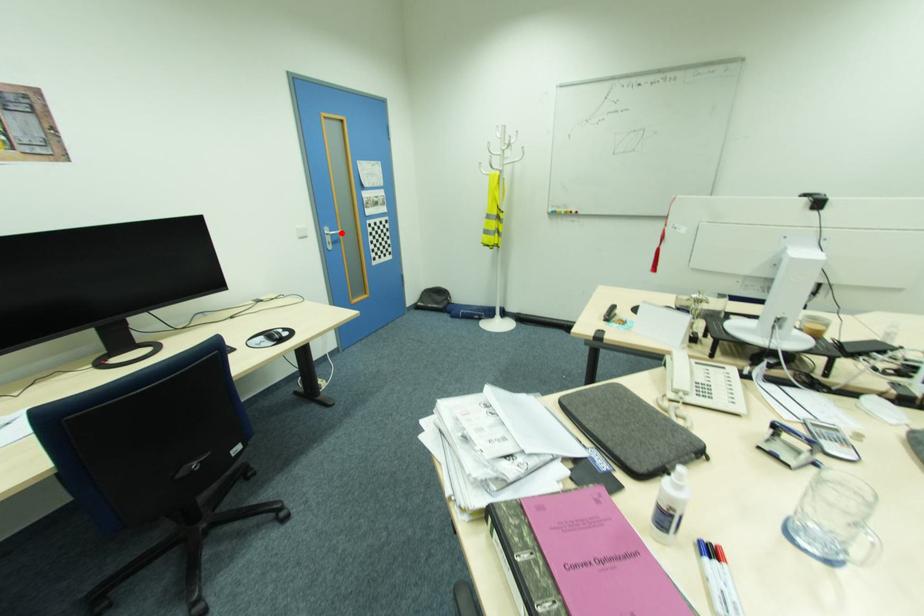
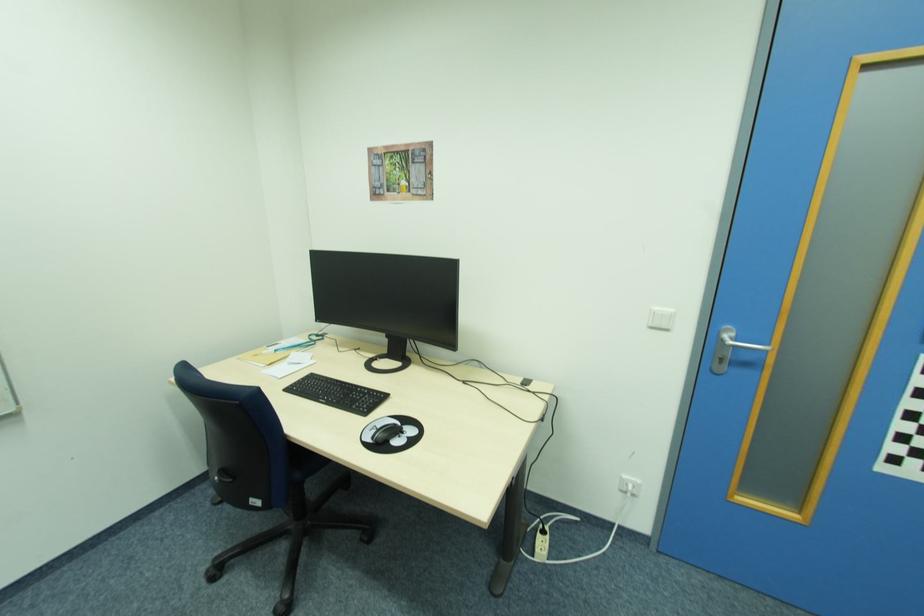
Question: A red point is marked in image1. In image2, is the corresponding 3D point closer to the camera or farther? Reply with the corresponding letter.

Choices:
 (A) The corresponding 3D point is closer.
 (B) The corresponding 3D point is farther.

Answer: (B)